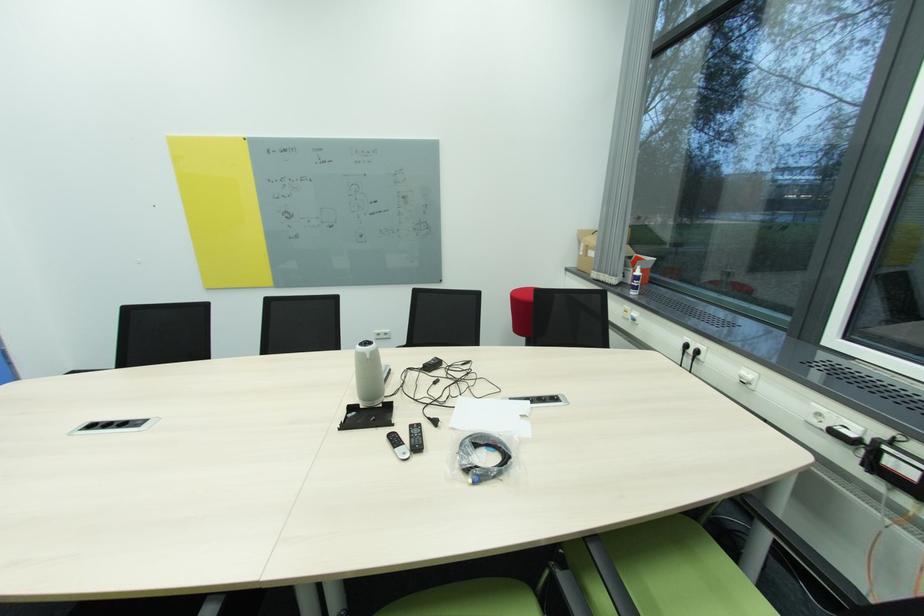
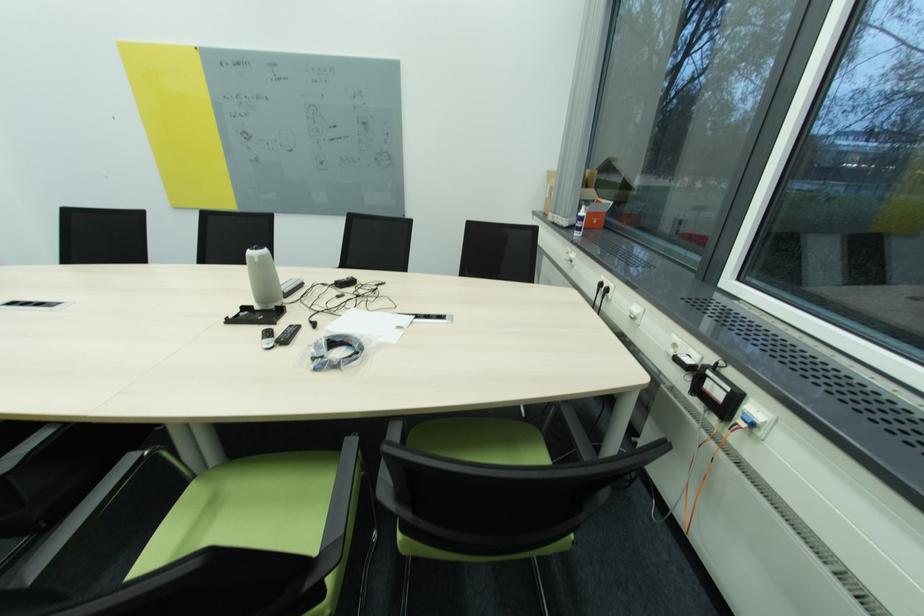
The point at (372, 358) is marked in the first image. Where is the corresponding point in the second image?

(261, 262)